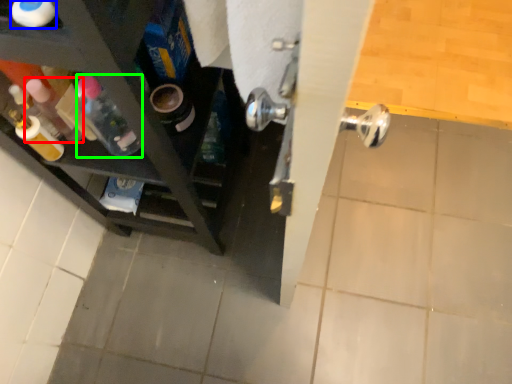
Question: Which is farther away from bottle (highlighted by a red box)? bottle (highlighted by a blue box) or bottle (highlighted by a green box)?

Choices:
 (A) bottle
 (B) bottle

Answer: (A)